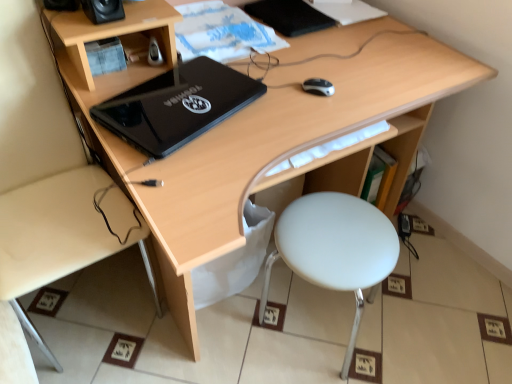
This screenshot has width=512, height=384. I want to click on black matte speaker at upper left, the second speaker viewed from the left, so click(x=103, y=10).

The width and height of the screenshot is (512, 384). I want to click on black plastic mouse at center, so click(318, 86).

This screenshot has height=384, width=512. Describe the element at coordinates (177, 106) in the screenshot. I see `black glossy laptop at center` at that location.

What are the coordinates of `black plastic speaker at upper left, the 2th speaker from the right` in the screenshot? It's located at (61, 5).

From a real-world perspective, is black glossy laptop at center located higher than black matte notebook at upper center?

Yes, from a real-world perspective, black glossy laptop at center is above black matte notebook at upper center.

Is black glossy laptop at center not near black matte notebook at upper center?

black glossy laptop at center is near black matte notebook at upper center, not far away.

Is black glossy laptop at center located outside black matte notebook at upper center?

black glossy laptop at center is positioned outside black matte notebook at upper center.

Is point (318, 86) in front of point (117, 19)?

No, (318, 86) is behind (117, 19).

Is black plastic mouse at center at the left side of black matte speaker at upper left, the second speaker viewed from the left?

No.

Is black matte speaker at upper left, the second speaker viewed from the left, inside black plastic mouse at center?

No, black matte speaker at upper left, the second speaker viewed from the left, is not a part of black plastic mouse at center.

Find the location of a particular element. This screenshot has height=384, width=512. the 1st speaker above when counting from the black plastic mouse at center (from the image's perspective) is located at coordinates (103, 10).

Considering the positions of point (186, 98) and point (84, 220), is point (186, 98) closer or farther from the camera than point (84, 220)?

Point (186, 98) appears to be closer to the viewer than point (84, 220).

Considering the sizes of black glossy laptop at center and light wood desk at lower left in the image, is black glossy laptop at center wider or thinner than light wood desk at lower left?

In the image, black glossy laptop at center appears to be more narrow than light wood desk at lower left.

Is black glossy laptop at center facing towards light wood desk at lower left?

No, black glossy laptop at center is not facing towards light wood desk at lower left.

Which object is closer to the camera, black glossy laptop at center or light wood desk at lower left?

light wood desk at lower left.

Which is more distant, (258, 4) or (317, 251)?

Positioned behind is point (258, 4).

From a real-world perspective, is black matte notebook at upper center beneath white plastic stool at lower right?

No, from a real-world perspective, black matte notebook at upper center is not below white plastic stool at lower right.

From the image's perspective, between black matte notebook at upper center and white plastic stool at lower right, who is located below?

white plastic stool at lower right, from the image's perspective.

Is black matte notebook at upper center shorter than white plastic stool at lower right?

Indeed, black matte notebook at upper center has a lesser height compared to white plastic stool at lower right.

Is the position of black glossy laptop at center less distant than that of black plastic speaker at upper left, which is the first speaker from left to right?

Yes, the depth of black glossy laptop at center is less than that of black plastic speaker at upper left, which is the first speaker from left to right.

Where is `speaker that is the 2nd one when counting backward from the black glossy laptop at center`? This screenshot has height=384, width=512. speaker that is the 2nd one when counting backward from the black glossy laptop at center is located at coordinates (61, 5).

Is point (117, 114) closer to camera compared to point (76, 2)?

Yes, it is.

Looking at this image, does black glossy laptop at center have a greater width compared to black plastic speaker at upper left, which is the first speaker from left to right?

Yes.

In terms of height, does black glossy laptop at center look taller or shorter compared to black plastic mouse at center?

Considering their sizes, black glossy laptop at center has more height than black plastic mouse at center.

You are a GUI agent. You are given a task and a screenshot of the screen. Output one action in this format:
    pyautogui.click(x=<x>, y=<y>)
    Task: Click on the laptop that appears in front of the black plastic mouse at center
    This screenshot has width=512, height=384.
    Given the screenshot: What is the action you would take?
    pyautogui.click(x=177, y=106)

Would you say black glossy laptop at center is inside or outside black plastic mouse at center?

black glossy laptop at center is not inside black plastic mouse at center, it's outside.

Can you tell me how much black glossy laptop at center and black plastic mouse at center differ in facing direction?

black glossy laptop at center and black plastic mouse at center are facing 4.12 degrees away from each other.

Between black glossy laptop at center and black matte speaker at upper left, the second speaker viewed from the left, which one has larger size?

black glossy laptop at center is bigger.

How much distance is there between black glossy laptop at center and black matte speaker at upper left, the first speaker in the right-to-left sequence?

The distance of black glossy laptop at center from black matte speaker at upper left, the first speaker in the right-to-left sequence, is 11.58 inches.

How different are the orientations of black glossy laptop at center and black matte speaker at upper left, the second speaker viewed from the left, in degrees?

There is a 18.5-degree angle between the facing directions of black glossy laptop at center and black matte speaker at upper left, the second speaker viewed from the left.

Locate an element on the screen. Image resolution: width=512 pixels, height=384 pixels. laptop that is in front of the black matte speaker at upper left, the second speaker viewed from the left is located at coordinates (177, 106).

At what (x,y) coordinates should I click in order to perform the action: click on notebook located above the black glossy laptop at center (from the image's perspective). Please return your answer as a coordinate pair (x, y). Looking at the image, I should click on (289, 16).

The height and width of the screenshot is (384, 512). I want to click on mouse lying below the black matte speaker at upper left, the second speaker viewed from the left (from the image's perspective), so [318, 86].

Estimate the real-world distances between objects in this image. Which object is closer to black plastic mouse at center, black matte speaker at upper left, the second speaker viewed from the left, or white plastic stool at lower right?

The object closer to black plastic mouse at center is white plastic stool at lower right.

Looking at the image, which one is located closer to black matte notebook at upper center, light wood desk at lower left or black glossy laptop at center?

black glossy laptop at center lies closer to black matte notebook at upper center than the other object.

From the image, which object appears to be farther from black matte speaker at upper left, the first speaker in the right-to-left sequence, black plastic mouse at center or white plastic stool at lower right?

white plastic stool at lower right is further to black matte speaker at upper left, the first speaker in the right-to-left sequence.

From the picture: When comparing their distances from black glossy laptop at center, does white plastic stool at lower right or black plastic mouse at center seem further?

white plastic stool at lower right lies further to black glossy laptop at center than the other object.

Considering their positions, is black matte notebook at upper center positioned closer to black glossy laptop at center than black matte speaker at upper left, the second speaker viewed from the left?

black matte speaker at upper left, the second speaker viewed from the left, lies closer to black glossy laptop at center than the other object.

Which object lies further to the anchor point black matte speaker at upper left, the first speaker in the right-to-left sequence, black plastic mouse at center or light wood desk at lower left?

The object further to black matte speaker at upper left, the first speaker in the right-to-left sequence, is light wood desk at lower left.

In the scene shown: Estimate the real-world distances between objects in this image. Which object is closer to black matte speaker at upper left, the first speaker in the right-to-left sequence, black matte notebook at upper center or black plastic speaker at upper left, which is the first speaker from left to right?

The object closer to black matte speaker at upper left, the first speaker in the right-to-left sequence, is black plastic speaker at upper left, which is the first speaker from left to right.

Estimate the real-world distances between objects in this image. Which object is further from black plastic mouse at center, black matte notebook at upper center or white plastic stool at lower right?

white plastic stool at lower right.

Find the location of `speaker between black plastic speaker at upper left, which is the first speaker from left to right, and black matte notebook at upper center`. speaker between black plastic speaker at upper left, which is the first speaker from left to right, and black matte notebook at upper center is located at coordinates (103, 10).

Find the location of `laptop between black matte speaker at upper left, the first speaker in the right-to-left sequence, and black plastic mouse at center, in the horizontal direction`. laptop between black matte speaker at upper left, the first speaker in the right-to-left sequence, and black plastic mouse at center, in the horizontal direction is located at coordinates (177, 106).

Where is `laptop that lies between black matte speaker at upper left, the second speaker viewed from the left, and light wood desk at lower left from top to bottom`? laptop that lies between black matte speaker at upper left, the second speaker viewed from the left, and light wood desk at lower left from top to bottom is located at coordinates [x=177, y=106].

The height and width of the screenshot is (384, 512). Identify the location of mouse between black matte speaker at upper left, the first speaker in the right-to-left sequence, and white plastic stool at lower right vertically. (318, 86).